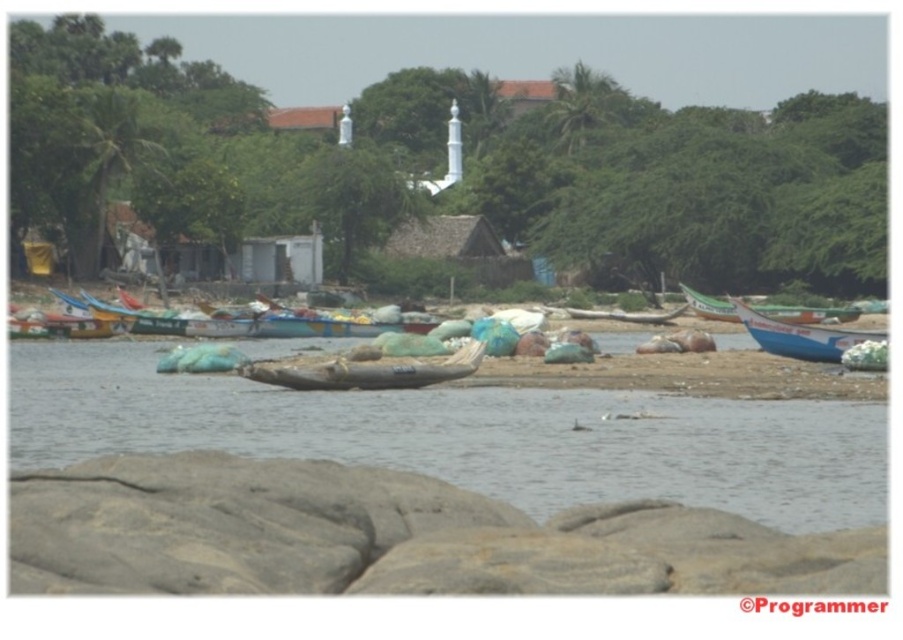
Consider the image. Is brown matte water at center bigger than brown woven basket at center?

Yes.

Does point (863, 435) come farther from viewer compared to point (436, 381)?

No, (863, 435) is closer to viewer.

Consider the image. Who is more forward, (340, 397) or (319, 358)?

Point (340, 397) is in front.

Identify the location of brown matte water at center. (468, 435).

In the scene shown: Does blue tarpaulin boat at center have a smaller size compared to blue painted wooden boat at right?

Correct, blue tarpaulin boat at center occupies less space than blue painted wooden boat at right.

Is blue tarpaulin boat at center positioned in front of blue painted wooden boat at right?

No, it is behind blue painted wooden boat at right.

Between point (317, 333) and point (807, 340), which one is positioned behind?

Positioned behind is point (317, 333).

Locate an element on the screen. blue tarpaulin boat at center is located at coordinates (332, 321).

Can you confirm if blue tarpaulin boat at center is positioned to the left of blue plastic boat at left?

No, blue tarpaulin boat at center is not to the left of blue plastic boat at left.

Locate an element on the screen. This screenshot has height=640, width=903. blue tarpaulin boat at center is located at coordinates (332, 321).